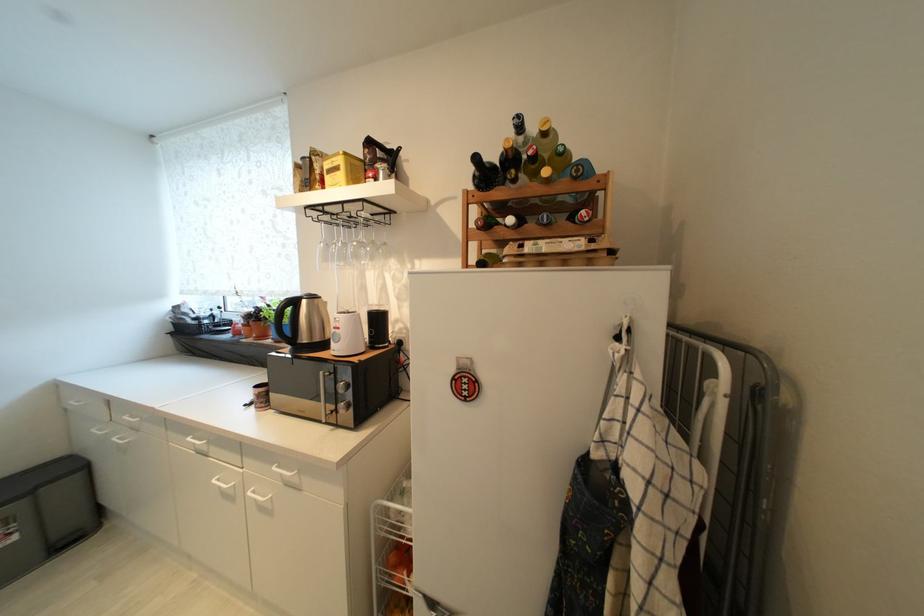
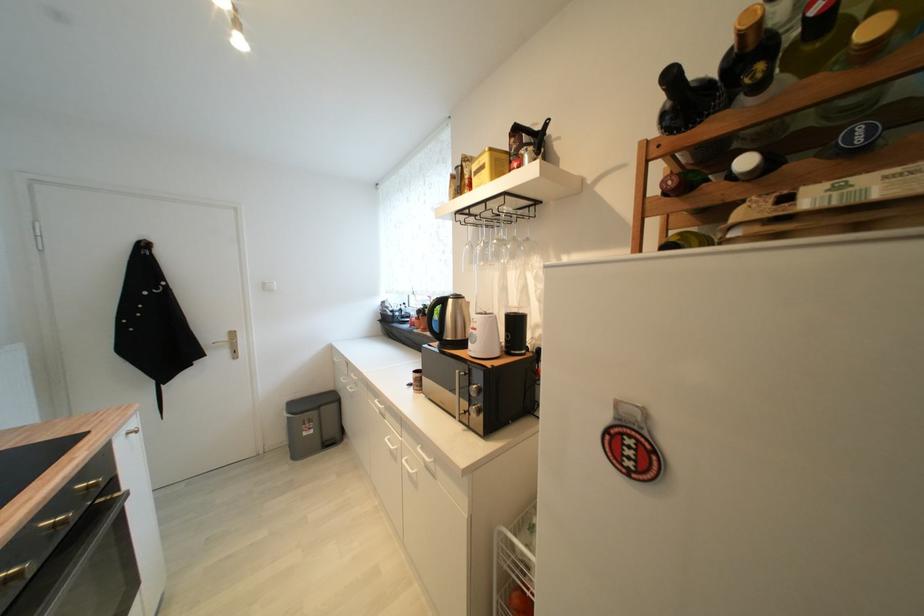
Find the pixel in the second image that matches point (371, 152) in the first image.

(517, 142)